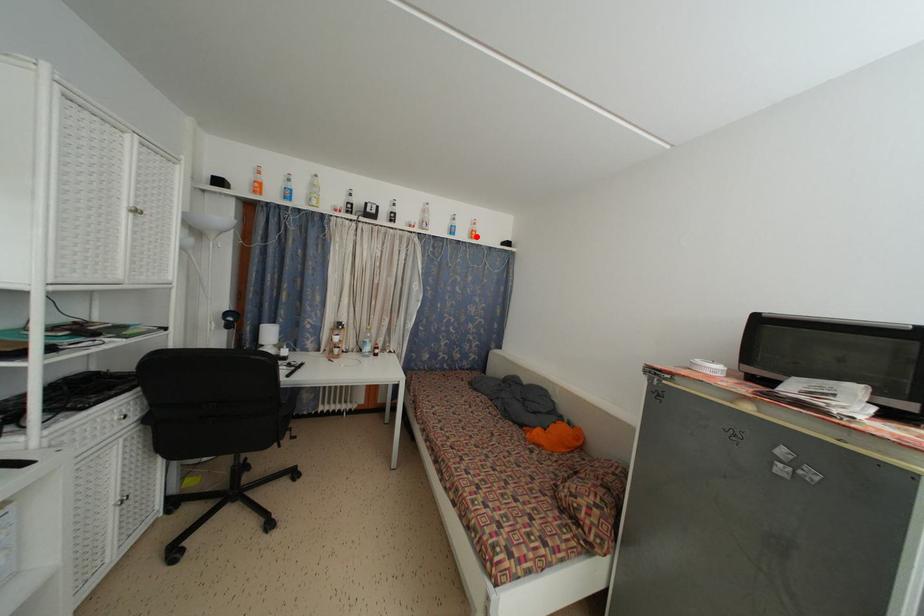
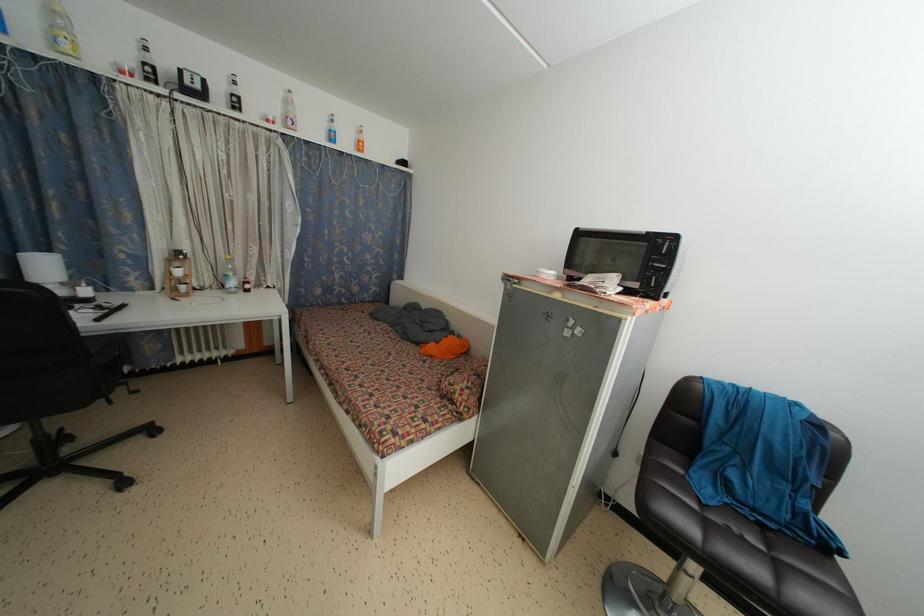
Where in the second image is the point corresponding to the highlighted location from the first image?

(362, 147)